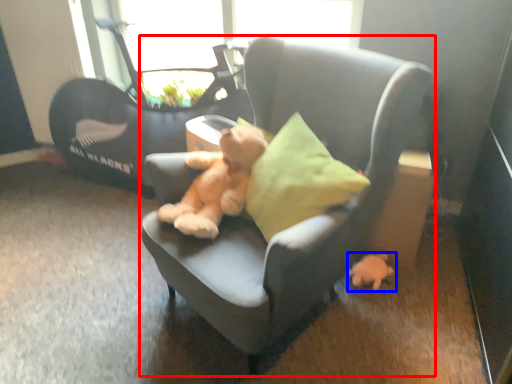
Question: Among these objects, which one is farthest to the camera, chair (highlighted by a red box) or toy (highlighted by a blue box)?

Choices:
 (A) chair
 (B) toy

Answer: (B)